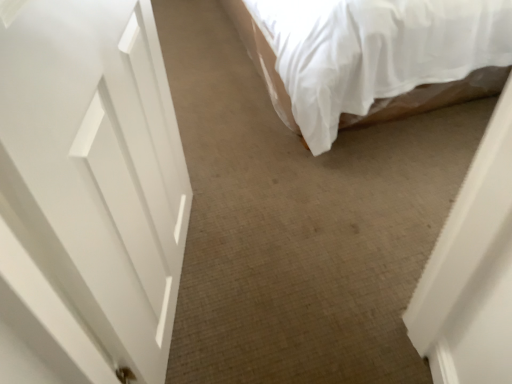
This screenshot has width=512, height=384. In order to click on vacant area that lies to the right of white glossy door at left in this screenshot , I will do pyautogui.click(x=291, y=267).